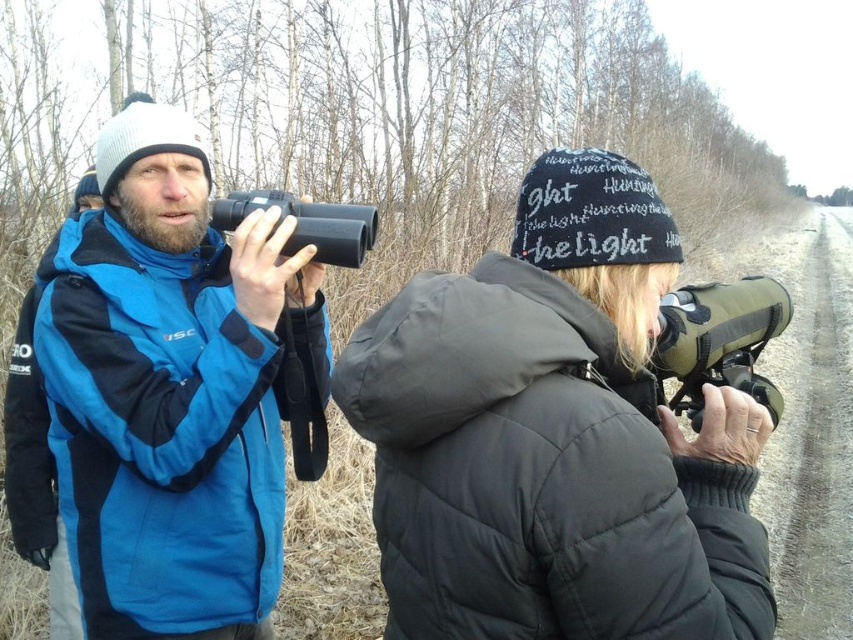
You are standing in a forest clearing and see two points marked in the scene. The first point is at coordinate point [61,330] and the second is at point [315,252]. Which point is closer to you?

Point [61,330] is closer to the viewer than point [315,252].

What are the coordinates of the matte black jacket at center?

The coordinates of the matte black jacket at center are at point (555, 436).